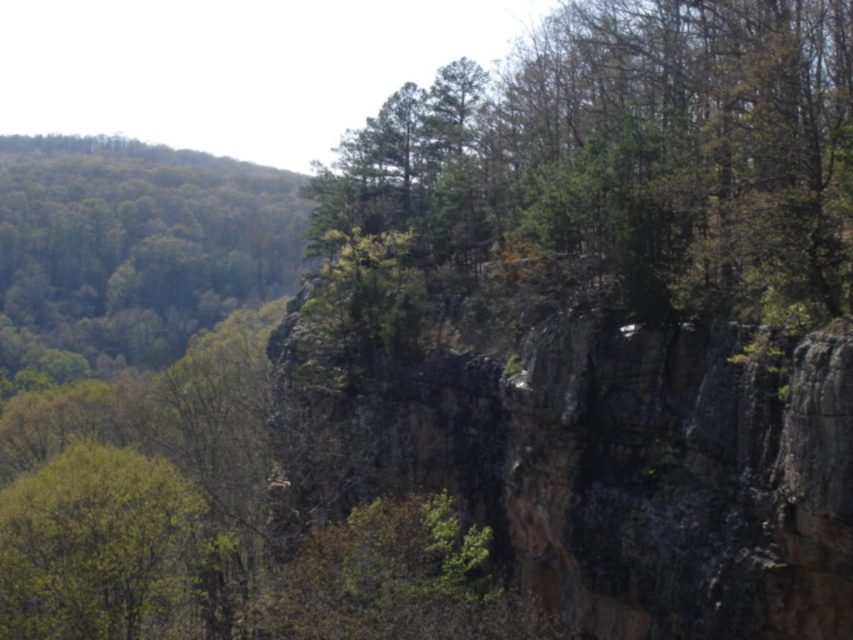
Is green leafy tree at center wider than green leafy tree at lower left?

Correct, the width of green leafy tree at center exceeds that of green leafy tree at lower left.

Does green leafy tree at center lie behind green leafy tree at lower left?

No, it is not.

At what (x,y) coordinates should I click in order to perform the action: click on green leafy tree at center. Please return your answer as a coordinate pair (x, y). The height and width of the screenshot is (640, 853). Looking at the image, I should click on (625, 163).

Locate an element on the screen. green leafy tree at center is located at coordinates tap(625, 163).